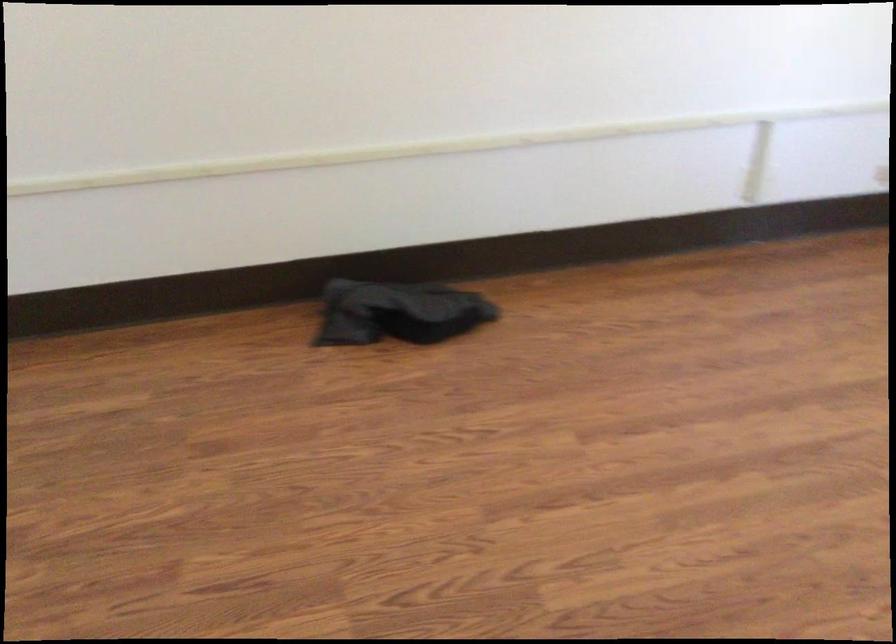
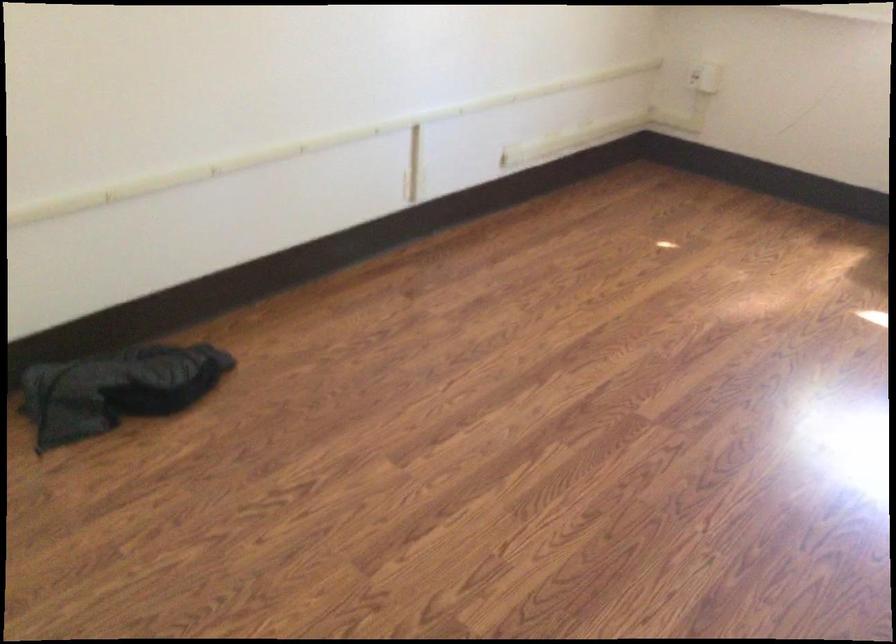
Question: How did the camera likely rotate?

Choices:
 (A) Left
 (B) Right
 (C) Up
 (D) Down

Answer: (B)